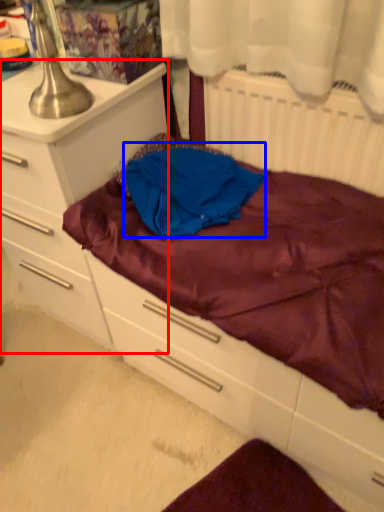
Question: Among these objects, which one is farthest to the camera, chest of drawers (highlighted by a red box) or clothing (highlighted by a blue box)?

Choices:
 (A) chest of drawers
 (B) clothing

Answer: (B)